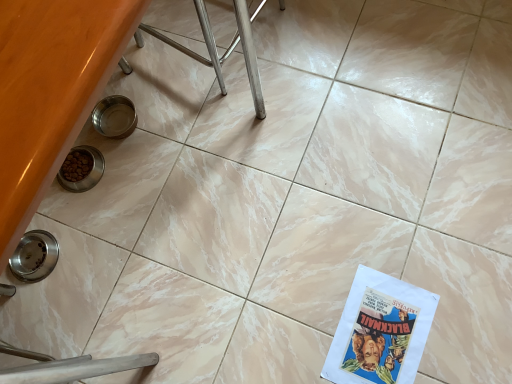
Question: From the image's perspective, is matte paper comic book at lower right located above brushed metal stool at upper center?

Choices:
 (A) yes
 (B) no

Answer: (B)

Question: Would you say brushed metal stool at upper center is part of matte paper comic book at lower right's contents?

Choices:
 (A) yes
 (B) no

Answer: (B)

Question: Considering the relative positions of matte paper comic book at lower right and brushed metal stool at upper center in the image provided, is matte paper comic book at lower right in front of brushed metal stool at upper center?

Choices:
 (A) yes
 (B) no

Answer: (B)

Question: Considering the relative sizes of matte paper comic book at lower right and brushed metal stool at upper center in the image provided, is matte paper comic book at lower right wider than brushed metal stool at upper center?

Choices:
 (A) no
 (B) yes

Answer: (A)

Question: Does matte paper comic book at lower right have a lesser height compared to brushed metal stool at upper center?

Choices:
 (A) yes
 (B) no

Answer: (A)

Question: From a real-world perspective, is matte paper comic book at lower right positioned under brushed metal stool at upper center based on gravity?

Choices:
 (A) yes
 (B) no

Answer: (A)

Question: Could matte paper comic book at lower right be considered to be inside brushed metal stool at upper center?

Choices:
 (A) no
 (B) yes

Answer: (A)

Question: Is brushed metal stool at upper center oriented towards matte paper comic book at lower right?

Choices:
 (A) no
 (B) yes

Answer: (A)

Question: Is brushed metal stool at upper center positioned with its back to matte paper comic book at lower right?

Choices:
 (A) yes
 (B) no

Answer: (B)

Question: Is brushed metal stool at upper center touching matte paper comic book at lower right?

Choices:
 (A) yes
 (B) no

Answer: (B)

Question: From the image's perspective, is brushed metal stool at upper center beneath matte paper comic book at lower right?

Choices:
 (A) no
 (B) yes

Answer: (A)

Question: Is brushed metal stool at upper center smaller than matte paper comic book at lower right?

Choices:
 (A) no
 (B) yes

Answer: (A)

Question: In terms of width, does brushed metal stool at upper center look wider or thinner when compared to matte paper comic book at lower right?

Choices:
 (A) wide
 (B) thin

Answer: (A)